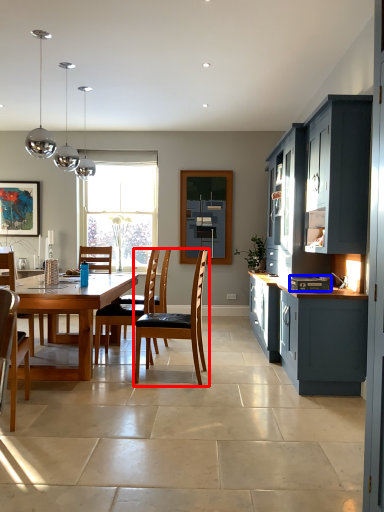
Question: Which object appears closest to the camera in this image, chair (highlighted by a red box) or appliance (highlighted by a blue box)?

Choices:
 (A) chair
 (B) appliance

Answer: (B)